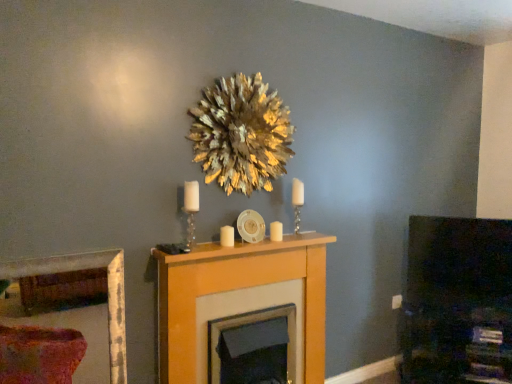
Where is `free space between white matte candle at center, acting as the 2th candle starting from the right, and white glossy candle at center, acting as the second candle starting from the left`? The width and height of the screenshot is (512, 384). free space between white matte candle at center, acting as the 2th candle starting from the right, and white glossy candle at center, acting as the second candle starting from the left is located at coordinates (251, 246).